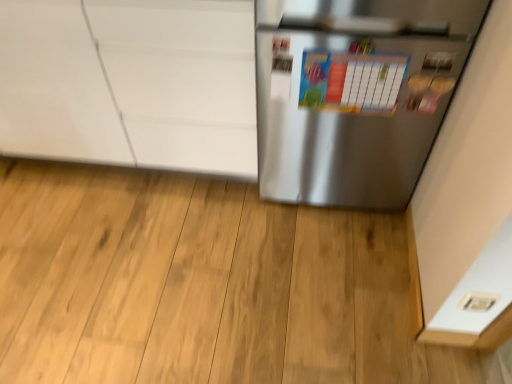
Question: From a real-world perspective, is white plastic electric outlet at lower right on colorful paperboard at center?

Choices:
 (A) no
 (B) yes

Answer: (A)

Question: Considering the relative sizes of white plastic electric outlet at lower right and colorful paperboard at center in the image provided, is white plastic electric outlet at lower right wider than colorful paperboard at center?

Choices:
 (A) no
 (B) yes

Answer: (B)

Question: Is white plastic electric outlet at lower right not near colorful paperboard at center?

Choices:
 (A) yes
 (B) no

Answer: (B)

Question: Is white plastic electric outlet at lower right surrounding colorful paperboard at center?

Choices:
 (A) yes
 (B) no

Answer: (B)

Question: Is white plastic electric outlet at lower right positioned before colorful paperboard at center?

Choices:
 (A) yes
 (B) no

Answer: (A)

Question: Can you confirm if white plastic electric outlet at lower right is bigger than colorful paperboard at center?

Choices:
 (A) no
 (B) yes

Answer: (A)

Question: Considering the relative sizes of satin silver refrigerator at right and white plastic electric outlet at lower right in the image provided, is satin silver refrigerator at right smaller than white plastic electric outlet at lower right?

Choices:
 (A) no
 (B) yes

Answer: (A)

Question: Can you confirm if satin silver refrigerator at right is shorter than white plastic electric outlet at lower right?

Choices:
 (A) yes
 (B) no

Answer: (B)

Question: From a real-world perspective, is satin silver refrigerator at right beneath white plastic electric outlet at lower right?

Choices:
 (A) no
 (B) yes

Answer: (A)

Question: Is satin silver refrigerator at right wider than white plastic electric outlet at lower right?

Choices:
 (A) no
 (B) yes

Answer: (B)

Question: Are satin silver refrigerator at right and white plastic electric outlet at lower right far apart?

Choices:
 (A) no
 (B) yes

Answer: (A)

Question: Is satin silver refrigerator at right taller than white plastic electric outlet at lower right?

Choices:
 (A) yes
 (B) no

Answer: (A)

Question: Does white glossy cabinet at upper left appear on the right side of colorful paperboard at center?

Choices:
 (A) yes
 (B) no

Answer: (B)